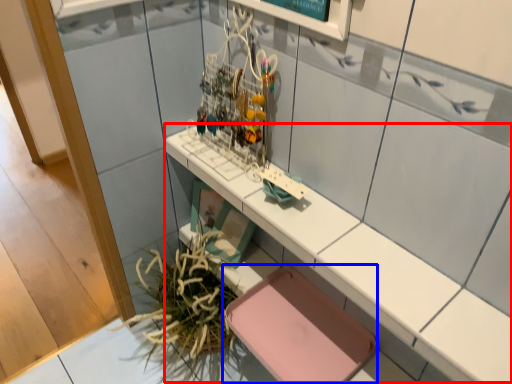
Question: Among these objects, which one is farthest to the camera, counter (highlighted by a red box) or chair (highlighted by a blue box)?

Choices:
 (A) counter
 (B) chair

Answer: (B)